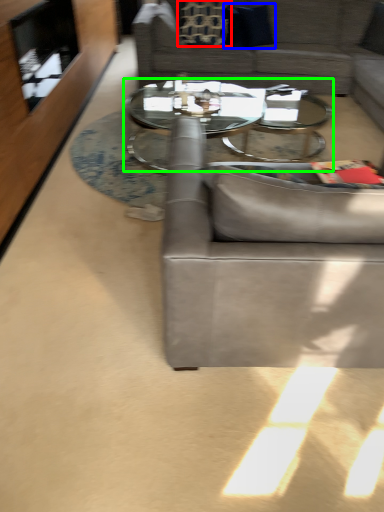
Question: Which is nearer to the pillow (highlighted by a red box)? pillow (highlighted by a blue box) or coffee table (highlighted by a green box).

Choices:
 (A) pillow
 (B) coffee table

Answer: (A)